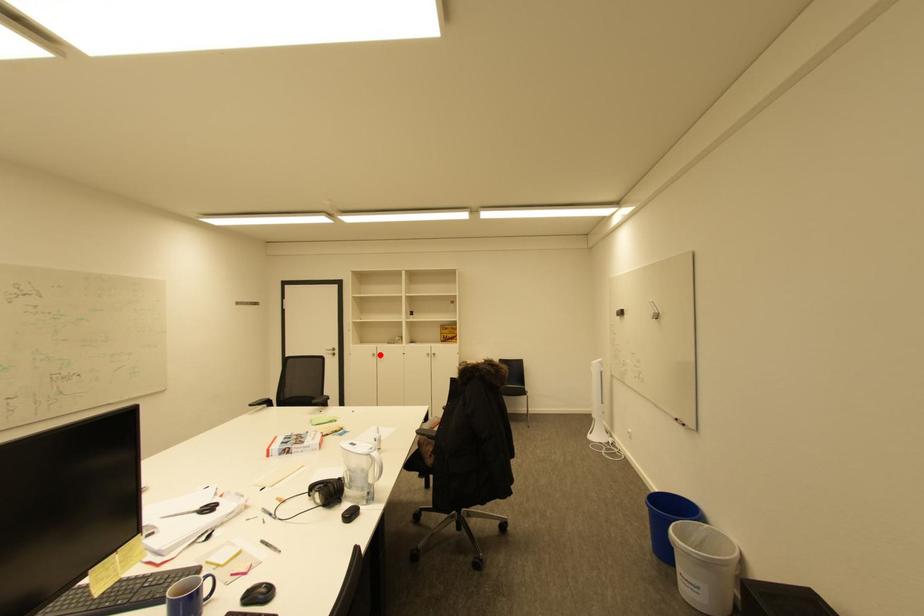
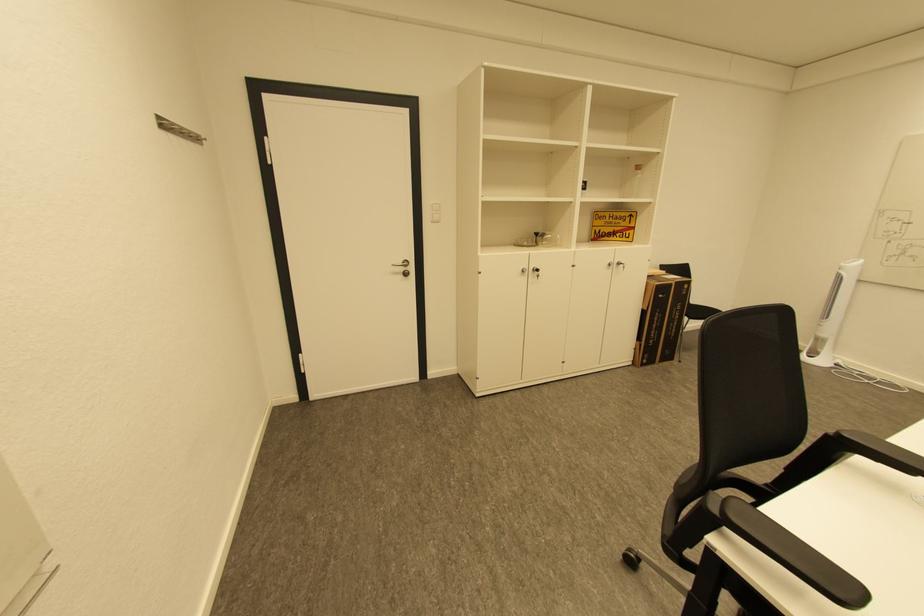
Find the pixel in the second image that matches the highlighted location in the first image.

(529, 272)